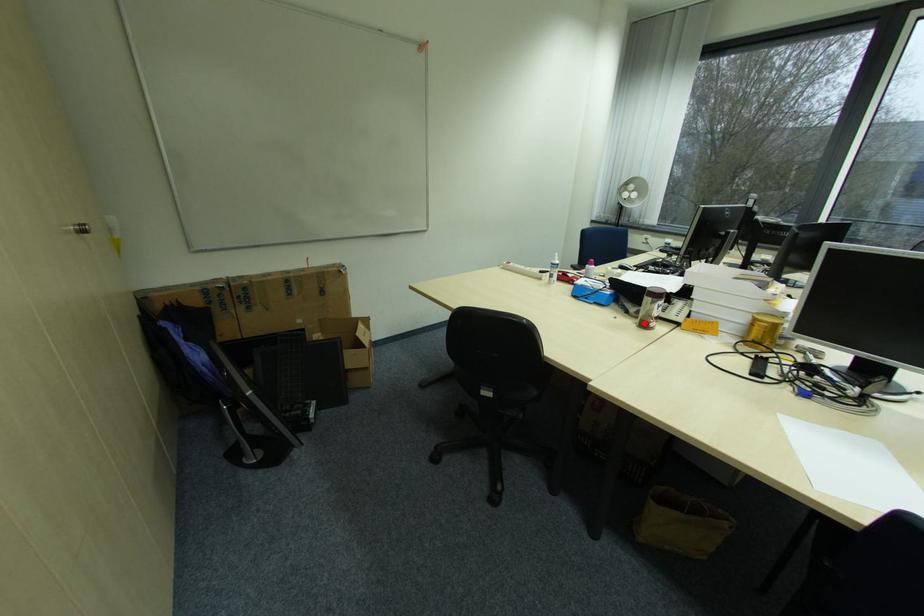
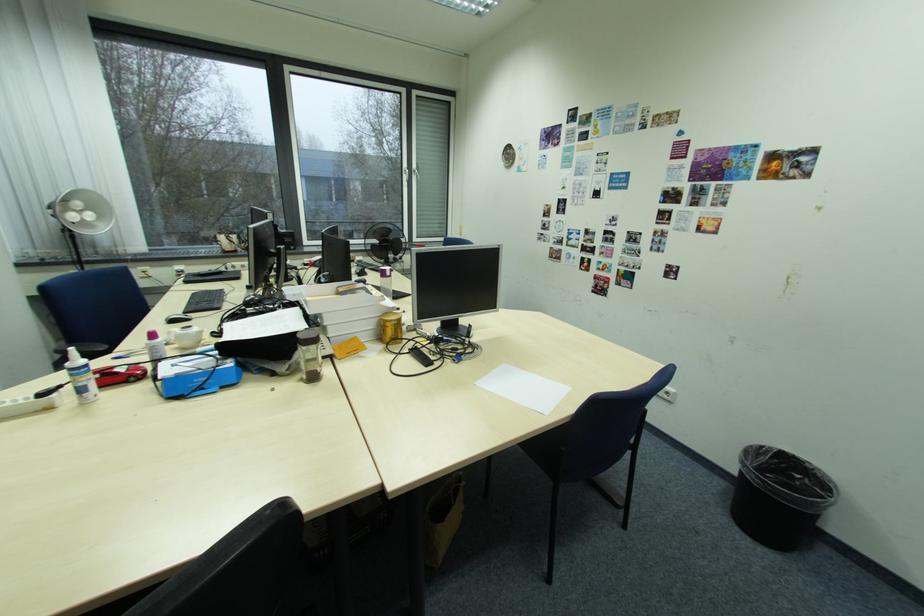
In the second image, find the point that corresponds to the highlighted location in the first image.

(310, 381)